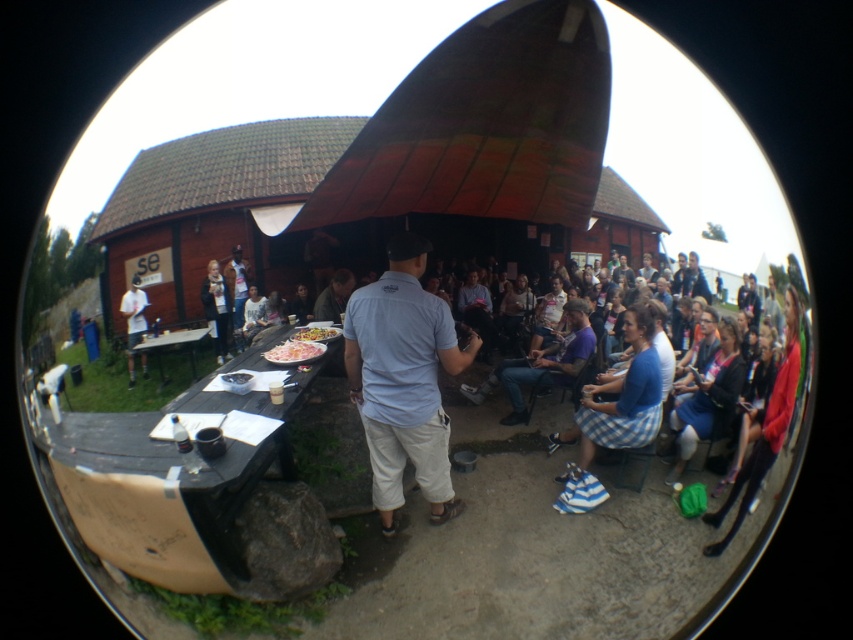
Question: Based on their relative distances, which object is nearer to the light blue cotton shirt at center?

Choices:
 (A) black wood picnic table at lower left
 (B) wooden picnic table at lower left
 (C) white cotton shirt at left
 (D) shiny pinkish-red meat at center

Answer: (A)

Question: Which point appears closest to the camera in this image?

Choices:
 (A) (136, 346)
 (B) (222, 380)
 (C) (140, 282)

Answer: (B)

Question: Where is light blue cotton shirt at center located in relation to wooden picnic table at lower left in the image?

Choices:
 (A) above
 (B) below

Answer: (B)

Question: Does wooden picnic table at lower left appear on the right side of matte gray shirt at center?

Choices:
 (A) yes
 (B) no

Answer: (B)

Question: From the image, what is the correct spatial relationship of white cotton shirt at left in relation to shiny pinkish-red meat at center?

Choices:
 (A) above
 (B) below

Answer: (A)

Question: Which object is closer to the camera taking this photo?

Choices:
 (A) black wood picnic table at lower left
 (B) white cotton shirt at left

Answer: (A)